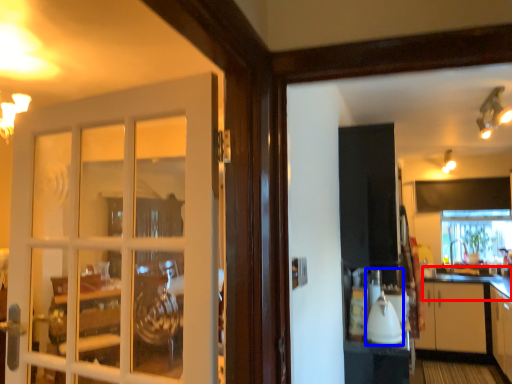
Question: Which object appears closest to the camera in this image, counter top (highlighted by a red box) or appliance (highlighted by a blue box)?

Choices:
 (A) counter top
 (B) appliance

Answer: (B)